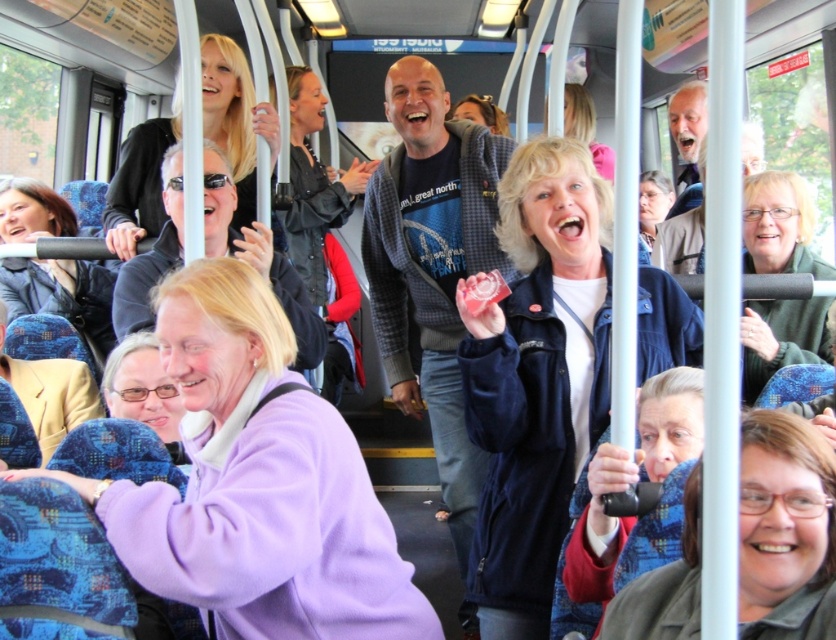
You are a passenger on the bus and want to hand your matte blue cardigan at center to the person holding the matte black camera at lower right. Can you reach them without moving from your seat?

The matte blue cardigan at center is to the left of the matte black camera at lower right, so you can reach them by passing the cardigan across to the right.

You are a passenger on the bus and you want to know which item is positioned lower between the matte blue cardigan at center and the purple fleece jacket at lower left. According to the scene description, which one is lower?

The matte blue cardigan at center is positioned below the purple fleece jacket at lower left, so the matte blue cardigan at center is lower.

You are a photographer trying to capture a candid shot of the purple fleece jacket at lower left without being noticed. The matte black camera at lower right is your only tool. Considering their heights, can you position yourself so that the camera is hidden behind the jacket while still framing the shot?

The matte black camera at lower right has a lesser height compared to the purple fleece jacket at lower left. Yes, you can position the camera behind the jacket since it is shorter, allowing it to be concealed while still capturing the shot.